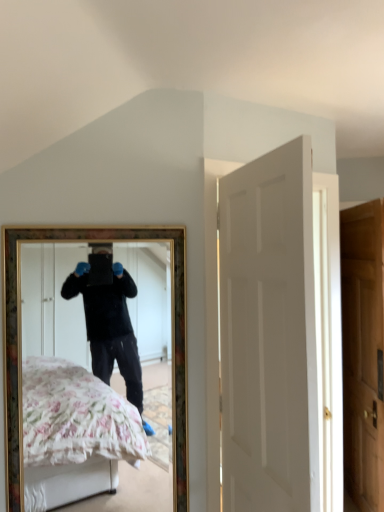
Question: Is wooden door at right, marked as the second door in a left-to-right arrangement, in front of or behind gold-framed mirror at center in the image?

Choices:
 (A) behind
 (B) front

Answer: (A)

Question: Considering the positions of wooden door at right, the first door from the back, and gold-framed mirror at center in the image, is wooden door at right, the first door from the back, wider or thinner than gold-framed mirror at center?

Choices:
 (A) wide
 (B) thin

Answer: (A)

Question: Based on their relative distances, which object is farther from the wooden door at right, marked as the second door in a left-to-right arrangement?

Choices:
 (A) gold-framed mirror at center
 (B) white matte door at center, the first door in the front-to-back sequence

Answer: (A)

Question: Estimate the real-world distances between objects in this image. Which object is farther from the gold-framed mirror at center?

Choices:
 (A) wooden door at right, the first door from the back
 (B) white matte door at center, which ranks as the 2th door in right-to-left order

Answer: (B)